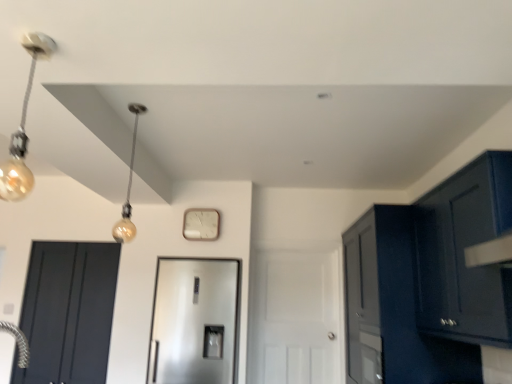
Question: In terms of width, does glossy dark blue cabinet at upper right, which is the first cabinetry from front to back, look wider or thinner when compared to white matte door at center, the first door in the right-to-left sequence?

Choices:
 (A) thin
 (B) wide

Answer: (B)

Question: Choose the correct answer: Is glossy dark blue cabinet at upper right, which is the second cabinetry in back-to-front order, inside white matte door at center, the first door in the right-to-left sequence, or outside it?

Choices:
 (A) inside
 (B) outside

Answer: (B)

Question: Based on their relative distances, which object is farther from the glossy dark blue cabinet at upper right, which is the first cabinetry from front to back?

Choices:
 (A) glossy dark blue cabinet at right, the 1th cabinetry from the back
 (B) satin silver refrigerator at center, which is the second door from right to left
 (C) matte gold bulb at upper left
 (D) gold glass bulb at left
 (E) white matte clock at center

Answer: (C)

Question: Estimate the real-world distances between objects in this image. Which object is farther from the glossy dark blue cabinet at upper right, which is the first cabinetry from front to back?

Choices:
 (A) white matte clock at center
 (B) matte black door at left, the 3th door viewed from the right
 (C) glossy dark blue cabinet at right, the 1th cabinetry from the back
 (D) matte gold bulb at upper left
 (E) gold glass bulb at left

Answer: (B)